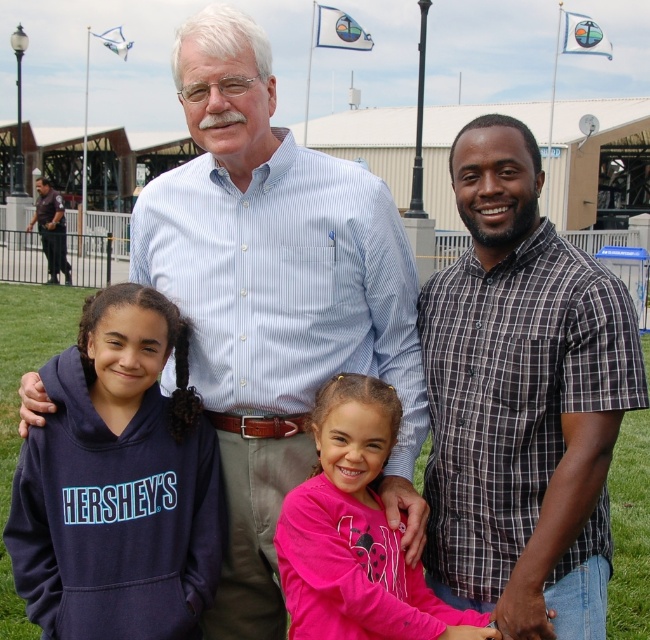
Is point (443, 547) more distant than point (358, 433)?

Yes.

Who is more distant from viewer, (x=599, y=502) or (x=318, y=560)?

The point (x=599, y=502) is more distant.

Image resolution: width=650 pixels, height=640 pixels. What do you see at coordinates (521, 401) in the screenshot?
I see `plaid shirt at right` at bounding box center [521, 401].

Identify the location of plaid shirt at right. Image resolution: width=650 pixels, height=640 pixels. (521, 401).

How far apart are plaid shirt at right and dark blue uniform at left?

plaid shirt at right and dark blue uniform at left are 19.07 meters apart from each other.

The width and height of the screenshot is (650, 640). I want to click on plaid shirt at right, so click(x=521, y=401).

Image resolution: width=650 pixels, height=640 pixels. Identify the location of plaid shirt at right. (521, 401).

Is navy blue hoodie at left smaller than dark blue uniform at left?

Indeed, navy blue hoodie at left has a smaller size compared to dark blue uniform at left.

Who is taller, navy blue hoodie at left or dark blue uniform at left?

With more height is dark blue uniform at left.

The image size is (650, 640). I want to click on navy blue hoodie at left, so click(x=118, y=496).